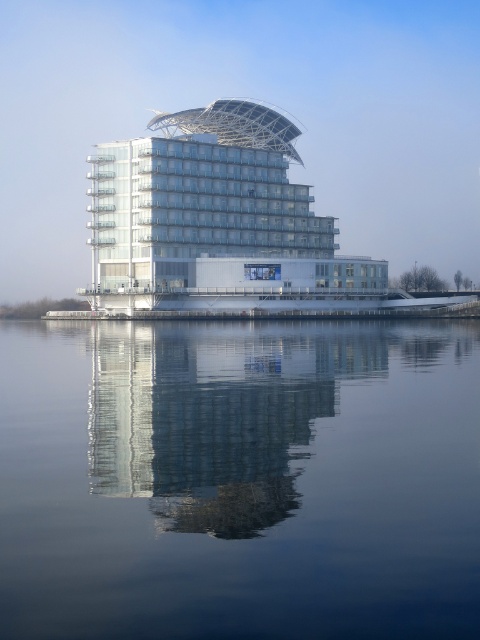
Question: Which is farther from the transparent glass water at center?

Choices:
 (A) white glass building at center
 (B) smooth glass building at center

Answer: (A)

Question: Can you confirm if transparent glass water at center is smaller than white glass building at center?

Choices:
 (A) no
 (B) yes

Answer: (B)

Question: From the image, what is the correct spatial relationship of transparent glass water at center in relation to white glass building at center?

Choices:
 (A) above
 (B) below

Answer: (B)

Question: Which point is farther from the camera taking this photo?

Choices:
 (A) (381, 337)
 (B) (131, 342)

Answer: (A)

Question: Is transparent glass water at center above white glass building at center?

Choices:
 (A) no
 (B) yes

Answer: (A)

Question: Which object is closer to the camera taking this photo?

Choices:
 (A) white glass building at center
 (B) transparent glass water at center

Answer: (B)